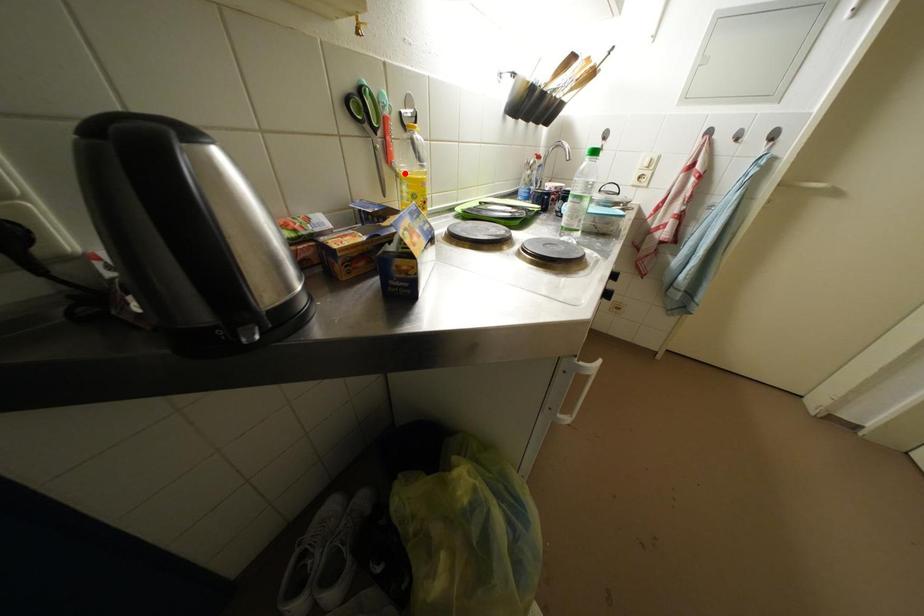
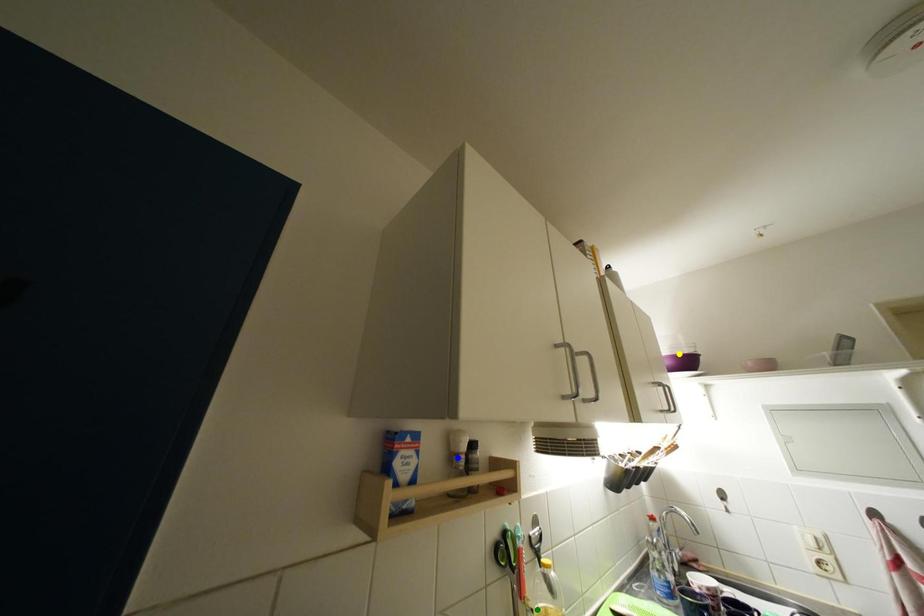
Question: I am providing you with two images of the same scene from different viewpoints. A red point is marked on the first image. You are given multiple points on the second image. Which point in image 2 represents the same 3d spot as the red point in image 1?

Choices:
 (A) blue point
 (B) yellow point
 (C) green point

Answer: (C)